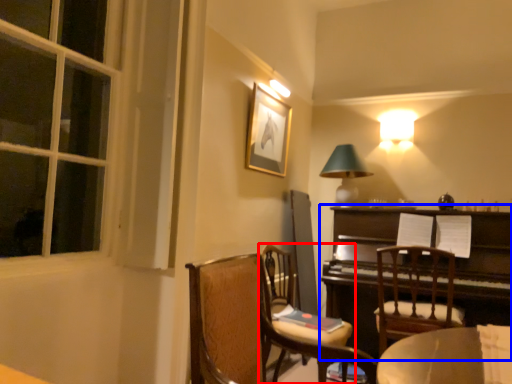
Question: Which point is closer to the camera, chair (highlighted by a red box) or piano (highlighted by a blue box)?

Choices:
 (A) chair
 (B) piano

Answer: (A)